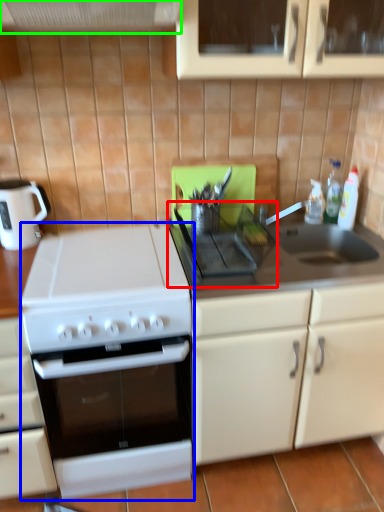
Question: Considering the real-world distances, which object is farthest from gas stove (highlighted by a red box)? gas stove (highlighted by a blue box) or exhaust hood (highlighted by a green box)?

Choices:
 (A) gas stove
 (B) exhaust hood

Answer: (B)